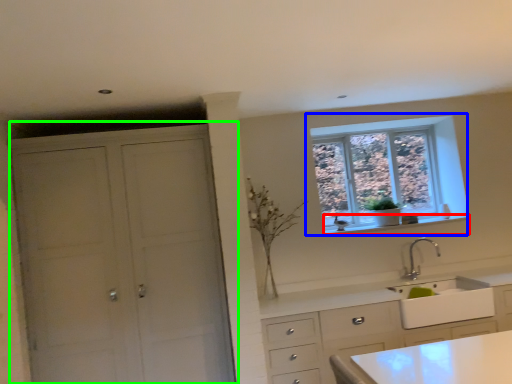
Question: Which object is positioned closest to window sill (highlighted by a red box)? Select from window (highlighted by a blue box) and cupboard (highlighted by a green box).

Choices:
 (A) window
 (B) cupboard

Answer: (A)